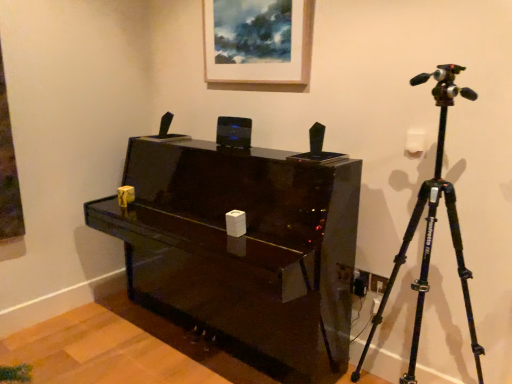
What do you see at coordinates (258, 41) in the screenshot? The width and height of the screenshot is (512, 384). I see `wooden picture frame at upper center` at bounding box center [258, 41].

This screenshot has height=384, width=512. In order to click on black matte tripod at right in this screenshot , I will do click(432, 227).

Find the location of a particular element. wooden picture frame at upper center is located at coordinates (258, 41).

Can you confirm if black matte tripod at right is positioned to the left of wooden picture frame at upper center?

Incorrect, black matte tripod at right is not on the left side of wooden picture frame at upper center.

Could you tell me if black matte tripod at right is turned towards wooden picture frame at upper center?

No, black matte tripod at right is not aimed at wooden picture frame at upper center.

Would you say black matte tripod at right contains wooden picture frame at upper center?

No, wooden picture frame at upper center is located outside of black matte tripod at right.

In the scene shown: Which is in front, black matte tripod at right or wooden picture frame at upper center?

black matte tripod at right is in front.

Would you say glossy black piano at center is to the left or to the right of wooden picture frame at upper center in the picture?

Based on their positions, glossy black piano at center is located to the left of wooden picture frame at upper center.

From a real-world perspective, which is physically below, glossy black piano at center or wooden picture frame at upper center?

glossy black piano at center.

Is glossy black piano at center bigger or smaller than wooden picture frame at upper center?

Clearly, glossy black piano at center is larger in size than wooden picture frame at upper center.

Locate an element on the screen. picture frame behind the glossy black piano at center is located at coordinates (258, 41).

Is point (254, 56) farther from camera compared to point (304, 350)?

Yes.

Is wooden picture frame at upper center oriented away from glossy black piano at center?

No, wooden picture frame at upper center is not facing the opposite direction of glossy black piano at center.

Does wooden picture frame at upper center have a greater width compared to glossy black piano at center?

Incorrect, the width of wooden picture frame at upper center does not surpass that of glossy black piano at center.

In terms of size, does black matte tripod at right appear bigger or smaller than glossy black piano at center?

Considering their sizes, black matte tripod at right takes up less space than glossy black piano at center.

From the image's perspective, would you say black matte tripod at right is positioned over glossy black piano at center?

Yes, from the image's perspective, black matte tripod at right is over glossy black piano at center.

Does point (372, 326) appear closer or farther from the camera than point (328, 327)?

Point (372, 326) is positioned farther from the camera compared to point (328, 327).

From the picture: Are black matte tripod at right and glossy black piano at center located far from each other?

No, black matte tripod at right is not far from glossy black piano at center.

From the picture: Can you confirm if glossy black piano at center is thinner than black matte tripod at right?

In fact, glossy black piano at center might be wider than black matte tripod at right.

Which is closer, (224, 165) or (458, 262)?

The point (458, 262) is closer to the camera.

Is glossy black piano at center facing away from black matte tripod at right?

No, glossy black piano at center's orientation is not away from black matte tripod at right.

Based on the photo, in terms of size, does glossy black piano at center appear bigger or smaller than black matte tripod at right?

Clearly, glossy black piano at center is larger in size than black matte tripod at right.

Is black matte tripod at right located within wooden picture frame at upper center?

That's incorrect, black matte tripod at right is not inside wooden picture frame at upper center.

Is wooden picture frame at upper center to the right of black matte tripod at right from the viewer's perspective?

No.

From the image's perspective, is wooden picture frame at upper center above or below black matte tripod at right?

From the image's perspective, wooden picture frame at upper center appears above black matte tripod at right.

Considering the sizes of objects wooden picture frame at upper center and black matte tripod at right in the image provided, who is wider, wooden picture frame at upper center or black matte tripod at right?

black matte tripod at right is wider.

In order to click on picture frame on the left of the black matte tripod at right in this screenshot , I will do `click(258, 41)`.

Where is `furniture in front of the wooden picture frame at upper center`? furniture in front of the wooden picture frame at upper center is located at coordinates (242, 250).

Estimate the real-world distances between objects in this image. Which object is closer to black matte tripod at right, wooden picture frame at upper center or glossy black piano at center?

Based on the image, glossy black piano at center appears to be nearer to black matte tripod at right.

From the image, which object appears to be nearer to glossy black piano at center, wooden picture frame at upper center or black matte tripod at right?

black matte tripod at right lies closer to glossy black piano at center than the other object.

From the image, which object appears to be farther from black matte tripod at right, glossy black piano at center or wooden picture frame at upper center?

wooden picture frame at upper center lies further to black matte tripod at right than the other object.

Considering their positions, is black matte tripod at right positioned closer to glossy black piano at center than wooden picture frame at upper center?

Among the two, black matte tripod at right is located nearer to glossy black piano at center.

When comparing their distances from wooden picture frame at upper center, does black matte tripod at right or glossy black piano at center seem closer?

glossy black piano at center.

Which object lies nearer to the anchor point wooden picture frame at upper center, glossy black piano at center or black matte tripod at right?

glossy black piano at center is positioned closer to the anchor wooden picture frame at upper center.

Locate an element on the screen. This screenshot has height=384, width=512. tripod that lies between wooden picture frame at upper center and glossy black piano at center from top to bottom is located at coordinates (432, 227).